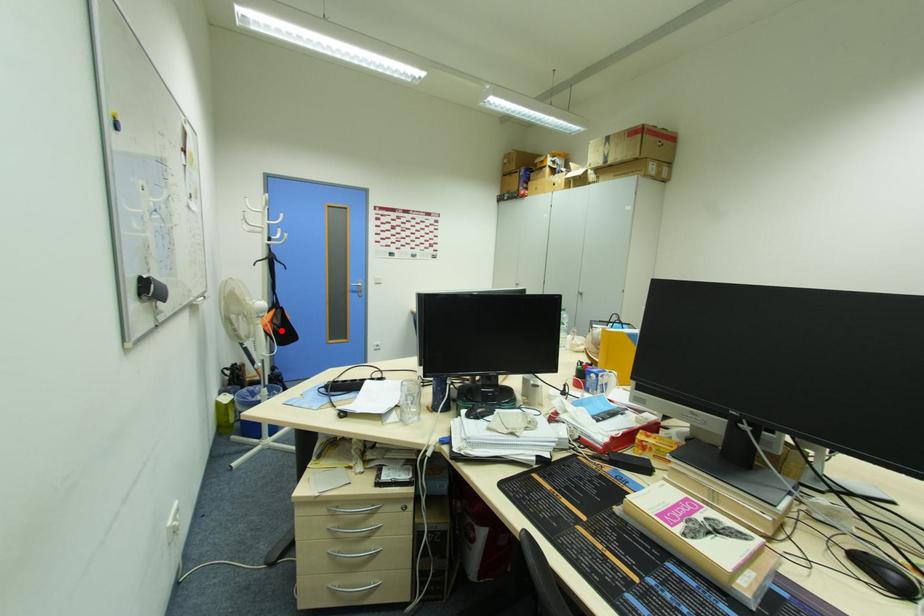
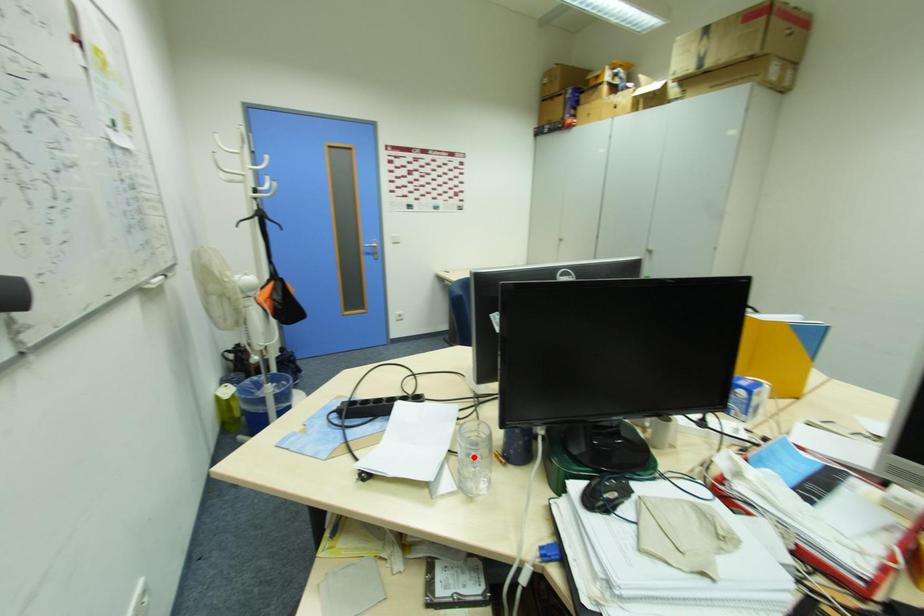
I am providing you with two images of the same scene from different viewpoints. A red point is marked on the first image and another point is marked on the second image. Do the highlighted points in image1 and image2 indicate the same real-world spot?

No